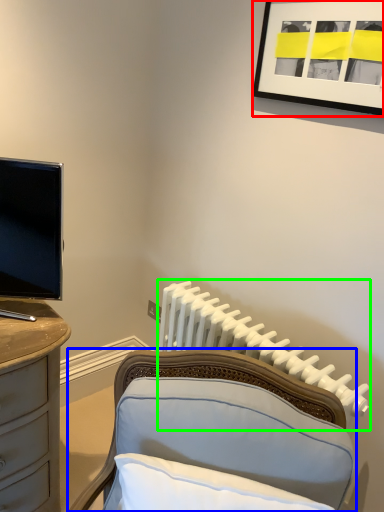
Question: Which object is positioned closest to picture frame (highlighted by a red box)? Select from furniture (highlighted by a blue box) and radiator (highlighted by a green box).

Choices:
 (A) furniture
 (B) radiator

Answer: (B)